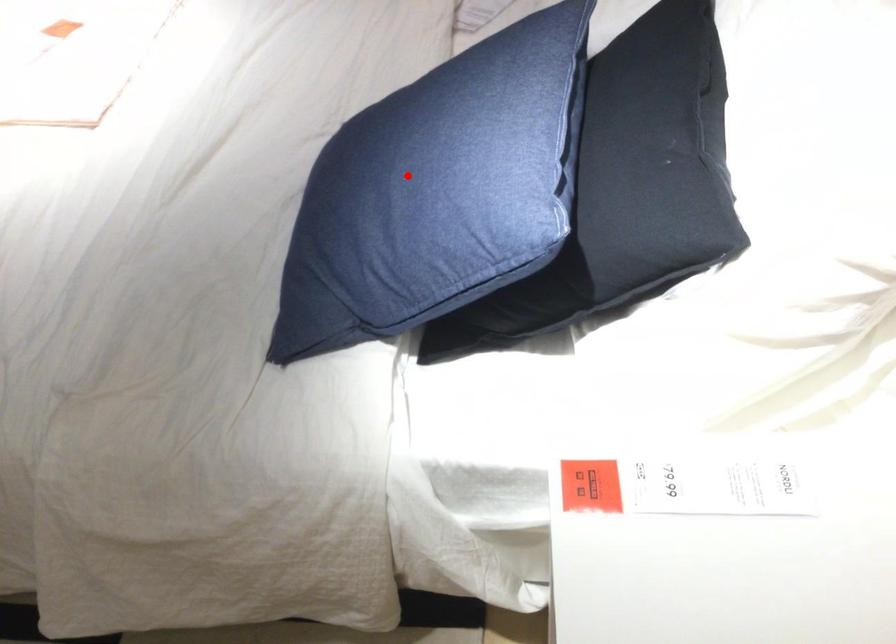
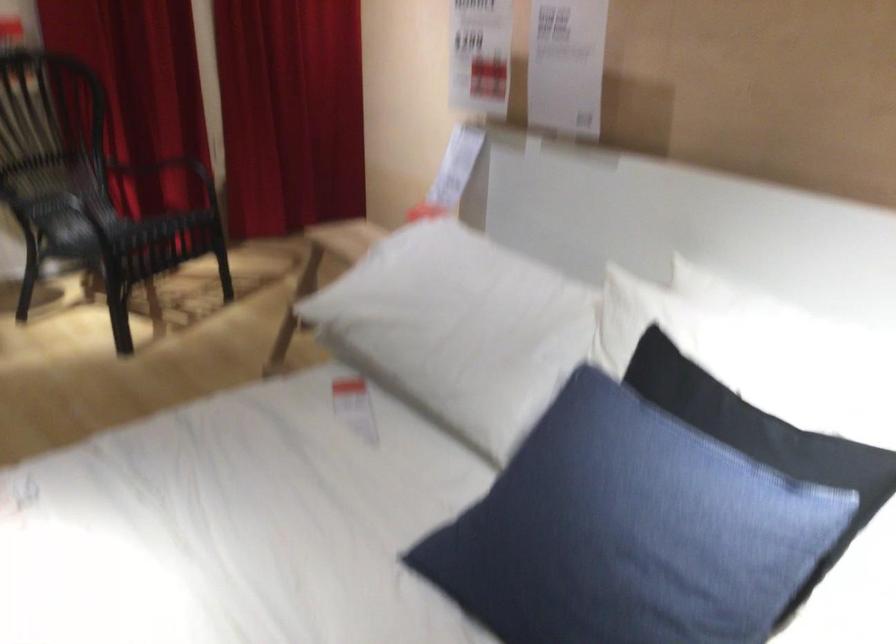
In the second image, find the point that corresponds to the highlighted location in the first image.

(644, 536)